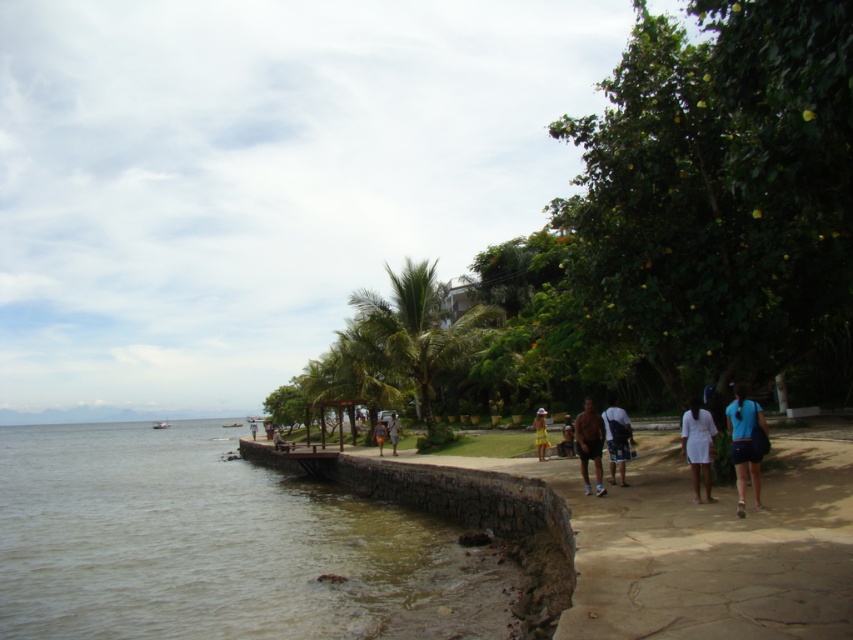
You are standing at the edge of the sandy pathway and want to take a photo of the green leafy palm tree at center. If your camera has a maximum zoom range of 100 feet, will you be able to capture the tree clearly without moving closer?

The green leafy palm tree at center is 78.66 feet away from the camera. Since the camera can zoom up to 100 feet, you can capture the tree clearly without moving closer.

You are a photographer standing on the sandy pathway and want to take a photo that includes both the green leafy palm tree at center and the white matte dress at lower right. Given the distance between them, can you frame both in a single shot with a standard zoom lens that has a maximum focal length of 50mm?

The green leafy palm tree at center and white matte dress at lower right are 22.62 meters apart. With a standard zoom lens up to 50mm, which has a wide angle, you should be able to capture both in one frame as 22.62 meters apart is within the lens capability for such a scene.